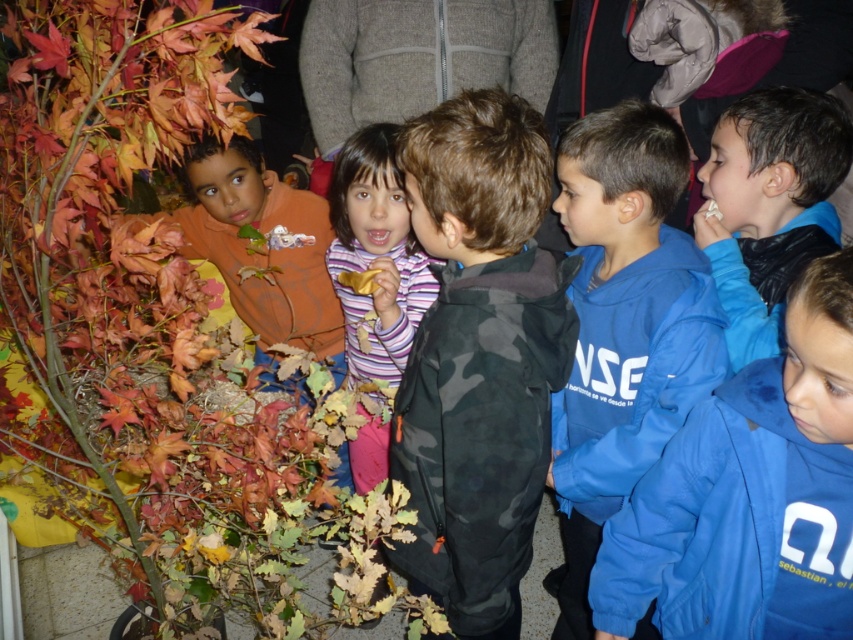
Between blue fabric jacket at right and blue fleece sweatshirt at center, which one is positioned lower?

blue fabric jacket at right

Is blue fabric jacket at right above blue fleece sweatshirt at center?

Actually, blue fabric jacket at right is below blue fleece sweatshirt at center.

Where is `blue fabric jacket at right`? The image size is (853, 640). blue fabric jacket at right is located at coordinates (750, 493).

Who is positioned more to the left, camouflage jacket at center or blue fabric jacket at right?

From the viewer's perspective, camouflage jacket at center appears more on the left side.

Which is below, camouflage jacket at center or blue fabric jacket at right?

blue fabric jacket at right is lower down.

Between point (444, 476) and point (662, 616), which one is positioned behind?

Positioned behind is point (662, 616).

Find the location of `camouflage jacket at center`. camouflage jacket at center is located at coordinates (479, 356).

Does point (477, 305) come behind point (688, 237)?

No, (477, 305) is in front of (688, 237).

Measure the distance between camouflage jacket at center and camera.

camouflage jacket at center is 1.12 meters away from camera.

Find the location of a particular element. Image resolution: width=853 pixels, height=640 pixels. camouflage jacket at center is located at coordinates (479, 356).